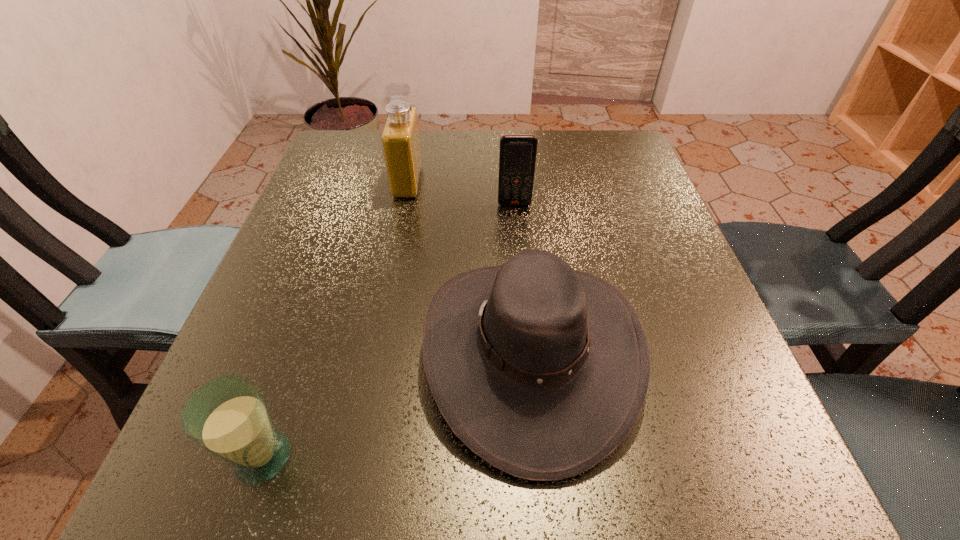
At what (x,y) coordinates should I click in order to perform the action: click on vacant space situated 0.180m on the back of the glass. Please return your answer as a coordinate pair (x, y). Looking at the image, I should click on point(309,320).

Where is `object that is positioned at the far edge`? This screenshot has height=540, width=960. object that is positioned at the far edge is located at coordinates (400, 138).

In order to click on cowboy hat that is at the near edge in this screenshot , I will do pos(541,370).

The width and height of the screenshot is (960, 540). I want to click on glass located at the near edge, so click(x=228, y=417).

At what (x,y) coordinates should I click in order to perform the action: click on object that is at the left edge. Please return your answer as a coordinate pair (x, y). The width and height of the screenshot is (960, 540). Looking at the image, I should click on [228, 417].

Find the location of `object present at the right edge`. object present at the right edge is located at coordinates (541, 370).

Find the location of a particular element. The width and height of the screenshot is (960, 540). object present at the near left corner is located at coordinates (228, 417).

Identify the location of object that is at the near right corner. Image resolution: width=960 pixels, height=540 pixels. (541, 370).

In the image, there is a desktop. Identify the location of vacant space at the far edge. (484, 173).

Image resolution: width=960 pixels, height=540 pixels. In the image, there is a desktop. In order to click on vacant space at the left edge in this screenshot , I will do `click(363, 189)`.